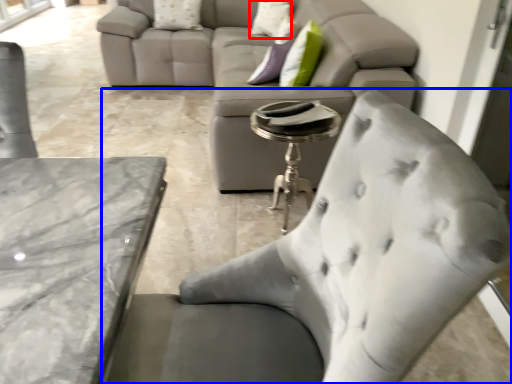
Question: Which object is closer to the camera taking this photo, pillow (highlighted by a red box) or chair (highlighted by a blue box)?

Choices:
 (A) pillow
 (B) chair

Answer: (B)